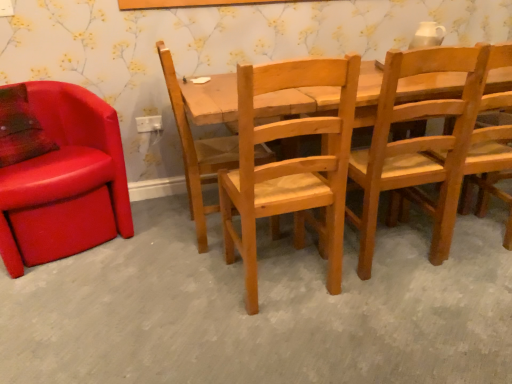
Identify the location of free point in front of wooden chair at center, which is counted as the second chair, starting from the right. The image size is (512, 384). (416, 304).